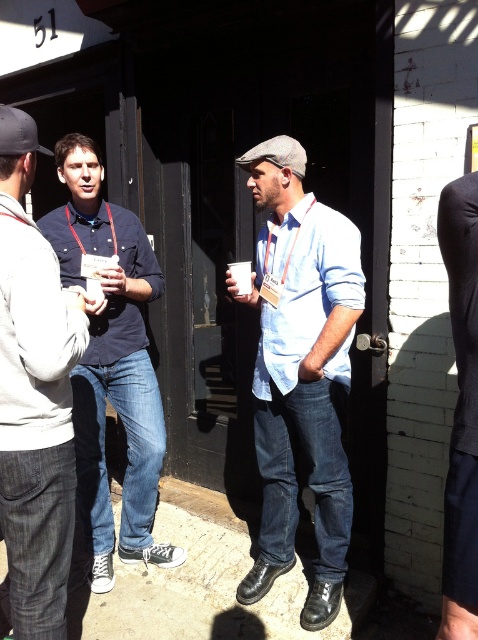
Who is more forward, (x=324, y=595) or (x=239, y=285)?

Point (x=324, y=595)

How distant is light blue denim jeans at center from white paper cup at center?

19.86 inches

Find the location of a particular element. light blue denim jeans at center is located at coordinates (301, 371).

Locate an element on the screen. light blue denim jeans at center is located at coordinates (x=301, y=371).

In the scene shown: Does dark blue shirt at center have a lesser width compared to white paper cup at center?

In fact, dark blue shirt at center might be wider than white paper cup at center.

Is point (84, 500) behind point (238, 262)?

Yes, point (84, 500) is behind point (238, 262).

Where is `dark blue shirt at center`? dark blue shirt at center is located at coordinates (111, 364).

Can you confirm if matte black shirt at left is positioned above black smooth pants at right?

Yes, matte black shirt at left is above black smooth pants at right.

Who is shorter, matte black shirt at left or black smooth pants at right?

Standing shorter between the two is black smooth pants at right.

Locate an element on the screen. The width and height of the screenshot is (478, 640). matte black shirt at left is located at coordinates (33, 397).